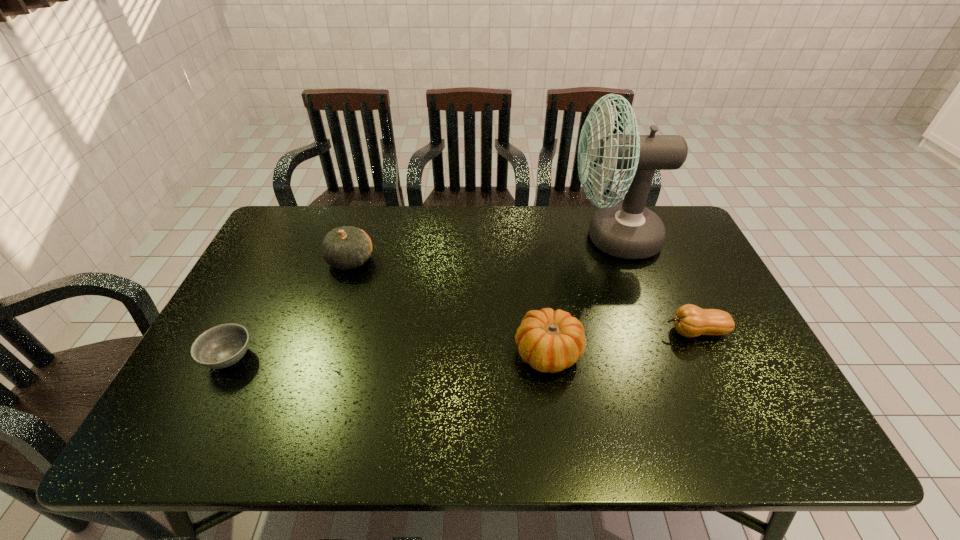
This screenshot has height=540, width=960. What are the coordinates of `the second closest gourd to the shortest gourd` in the screenshot? It's located at (347, 247).

Locate an element on the screen. Image resolution: width=960 pixels, height=540 pixels. gourd that can be found as the closest to the bowl is located at coordinates (347, 247).

This screenshot has width=960, height=540. Find the location of `free region that satisfies the following two spatial constraints: 1. on the back side of the second gourd from right to left; 2. on the left side of the shortest object`. free region that satisfies the following two spatial constraints: 1. on the back side of the second gourd from right to left; 2. on the left side of the shortest object is located at coordinates (x=231, y=353).

Find the location of a particular element. vacant position in the image that satisfies the following two spatial constraints: 1. on the stem side of the fourth tallest object; 2. on the front side of the leftmost object is located at coordinates (708, 357).

The image size is (960, 540). I want to click on vacant space that satisfies the following two spatial constraints: 1. on the stem side of the second shortest object; 2. on the front side of the shortest object, so click(x=708, y=357).

This screenshot has height=540, width=960. Identify the location of free space that satisfies the following two spatial constraints: 1. on the front side of the leftmost gourd; 2. on the right side of the second gourd from right to left. tap(321, 353).

In order to click on free spot that satisfies the following two spatial constraints: 1. on the back side of the farthest gourd; 2. on the left side of the bowl in this screenshot , I will do `click(278, 260)`.